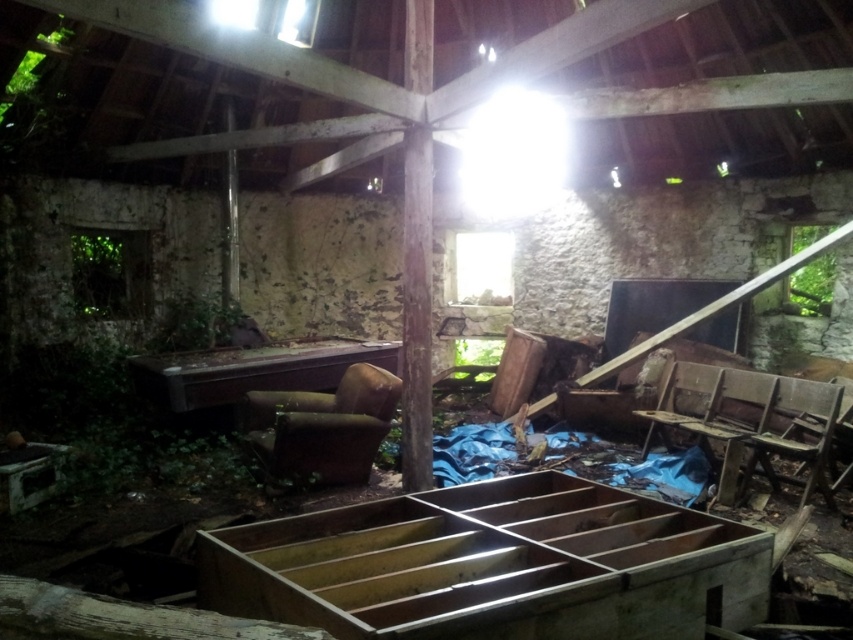
Is brown leather chair at center smaller than worn wood chair at center-right?

No.

At what (x,y) coordinates should I click in order to perform the action: click on brown leather chair at center. Please return your answer as a coordinate pair (x, y). Looking at the image, I should click on (322, 426).

The width and height of the screenshot is (853, 640). Identify the location of brown leather chair at center. (322, 426).

In order to click on brown leather chair at center in this screenshot , I will do `click(322, 426)`.

Who is shorter, wooden crate at center or wooden desk at center?

wooden crate at center is shorter.

Does wooden crate at center appear on the left side of wooden desk at center?

No, wooden crate at center is not to the left of wooden desk at center.

Does point (726, 540) come farther from viewer compared to point (347, 356)?

No, (726, 540) is closer to viewer.

Find the location of a particular element. The height and width of the screenshot is (640, 853). wooden crate at center is located at coordinates (492, 564).

Who is more distant from viewer, (270, 445) or (830, 406)?

The point (270, 445) is behind.

From the picture: Who is lower down, brown leather chair at center or wooden chair at right?

wooden chair at right is below.

You are a GUI agent. You are given a task and a screenshot of the screen. Output one action in this format:
    pyautogui.click(x=<x>, y=<y>)
    Task: Click on the brown leather chair at center
    
    Given the screenshot: What is the action you would take?
    pyautogui.click(x=322, y=426)